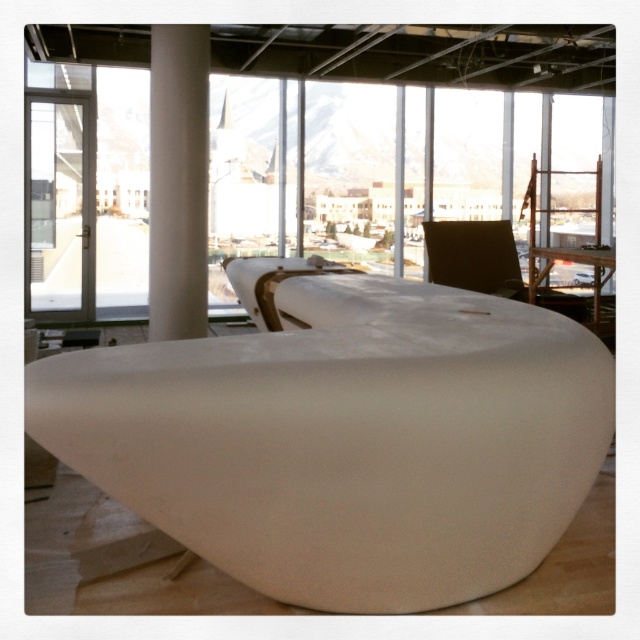
Question: Is white smooth column at center positioned before brown leather chair at upper right?

Choices:
 (A) yes
 (B) no

Answer: (A)

Question: Among these points, which one is farthest from the camera?

Choices:
 (A) (456, 237)
 (B) (196, 336)

Answer: (A)

Question: Which of the following is the farthest from the observer?

Choices:
 (A) white smooth column at center
 (B) brown leather chair at upper right

Answer: (B)

Question: Is white smooth column at center thinner than brown leather chair at upper right?

Choices:
 (A) yes
 (B) no

Answer: (A)

Question: Does white smooth column at center have a larger size compared to brown leather chair at upper right?

Choices:
 (A) yes
 (B) no

Answer: (A)